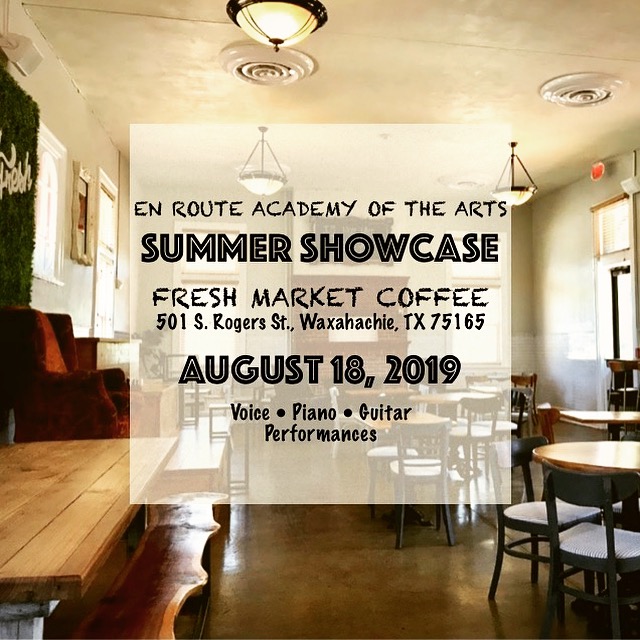
Where is `wood table`? wood table is located at coordinates (56, 524).